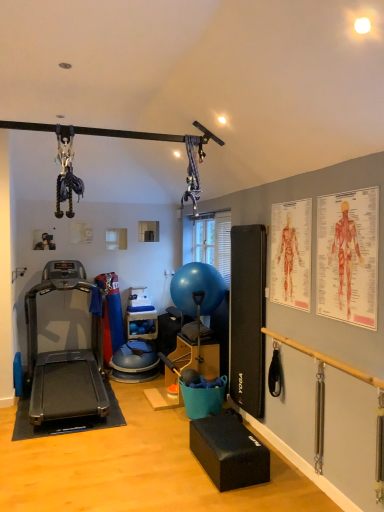
This screenshot has height=512, width=384. I want to click on free point above wooden bar at right (from a real-world perspective), so click(x=324, y=346).